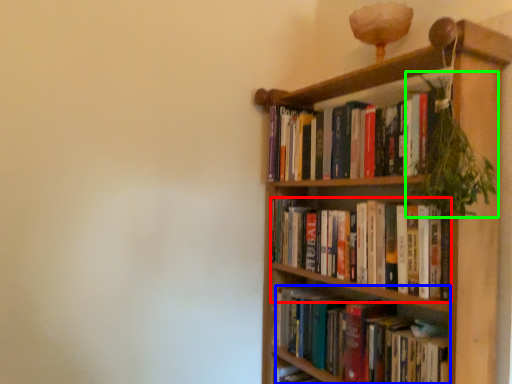
Question: Which object is positioned farthest from book (highlighted by a red box)? Select from book (highlighted by a blue box) and vegetation (highlighted by a green box).

Choices:
 (A) book
 (B) vegetation

Answer: (B)